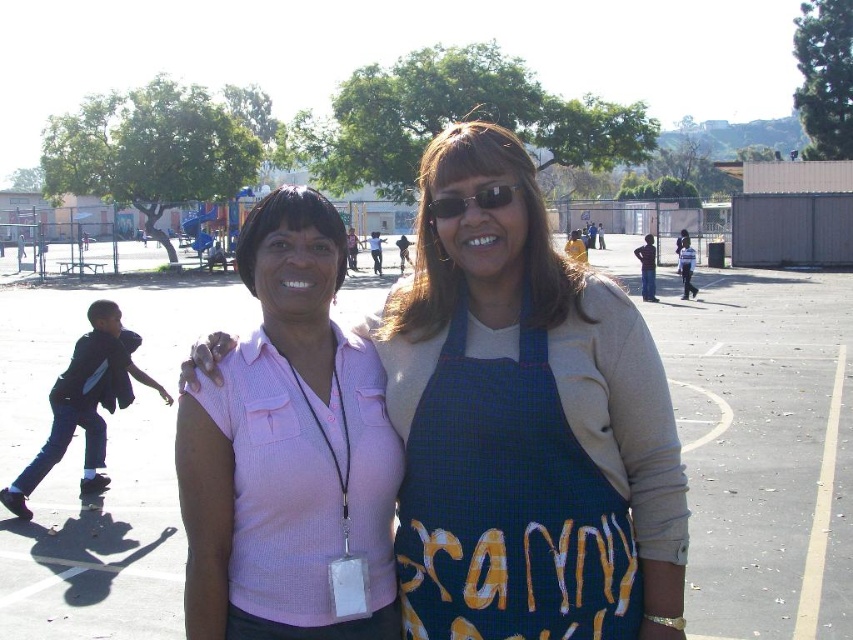
You are organizing a clothing donation drive and need to categorize items by size. You have two items in front of you, the pink ribbed shirt at center and the blue checkered apron at center. Which item should you place in the large size bin?

The pink ribbed shirt at center is larger in size than the blue checkered apron at center, so you should place the pink ribbed shirt at center in the large size bin.

Based on the photo, you are a photographer trying to capture a photo of both the pink ribbed shirt at center and the blue checkered apron at center. Since you want them to be side by side in the frame, which one should you position to the left side of the photo?

The pink ribbed shirt at center is already to the left of the blue checkered apron at center, so you should position the pink ribbed shirt at center on the left side of the photo and the blue checkered apron at center on the right side to keep them side by side.